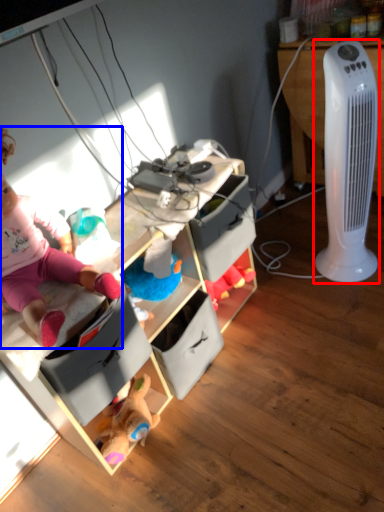
Question: Which object appears closest to the camera in this image, home appliance (highlighted by a red box) or person (highlighted by a blue box)?

Choices:
 (A) home appliance
 (B) person

Answer: (B)